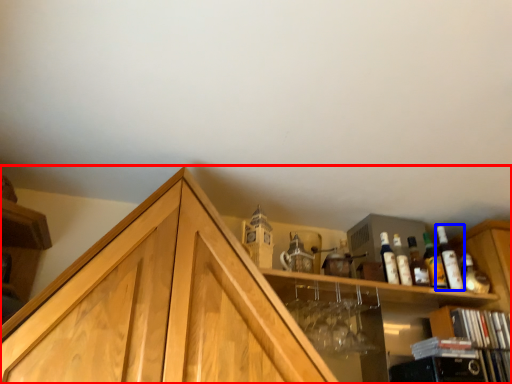
Question: Which of the following is the closest to the observer, cabinetry (highlighted by a red box) or bottle (highlighted by a blue box)?

Choices:
 (A) cabinetry
 (B) bottle

Answer: (A)